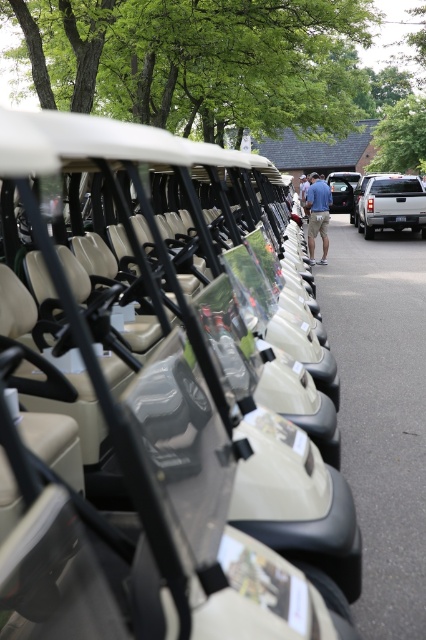
Question: Among these objects, which one is nearest to the camera?

Choices:
 (A) blue denim shorts at center
 (B) silver metallic truck at right
 (C) beige matte golf cart at center

Answer: (C)

Question: Which of the following is the closest to the observer?

Choices:
 (A) (310, 250)
 (B) (344, 184)
 (C) (412, 227)

Answer: (A)

Question: Is beige matte golf cart at center below blue denim shorts at center?

Choices:
 (A) yes
 (B) no

Answer: (A)

Question: Does beige matte golf cart at center appear on the left side of blue denim shorts at center?

Choices:
 (A) no
 (B) yes

Answer: (B)

Question: Can you confirm if silver metallic truck at right is thinner than metallic silver suv at center?

Choices:
 (A) yes
 (B) no

Answer: (A)

Question: Which object appears farthest from the camera in this image?

Choices:
 (A) silver metallic truck at right
 (B) beige matte golf cart at center

Answer: (A)